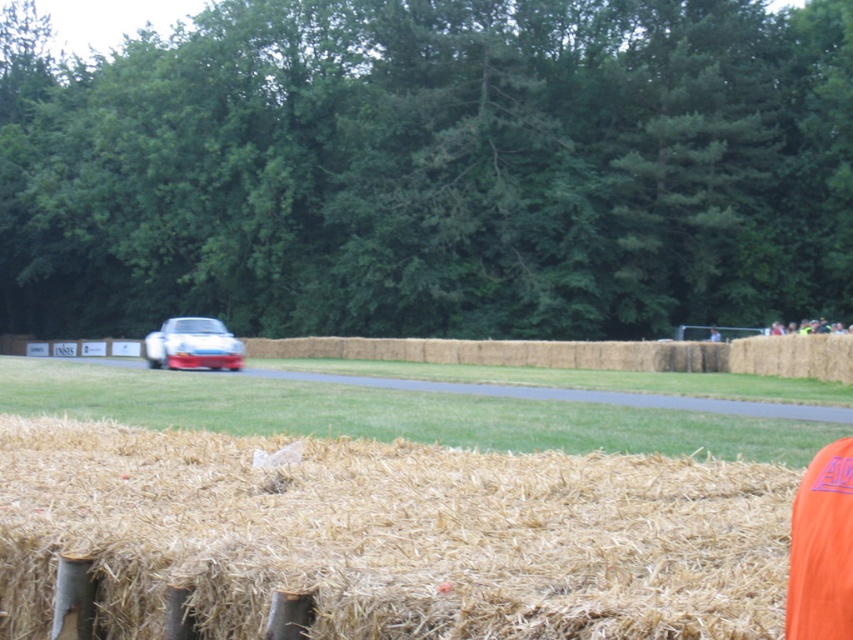
Looking at this image, you are a photographer trying to capture the white glossy car at center while ensuring the straw bales at lower center do not block the view. Based on their heights, will the car be visible over the straw bales?

The white glossy car at center is taller than the straw bales at lower center, so the car will be visible over the straw bales.

You are a delivery drone that needs to land on the smooth asphalt road at center. However, there are straw bales at lower center in the way. Can you safely descend vertically to the road without hitting the straw bales?

The straw bales at lower center has a lesser height compared to smooth asphalt road at center. Since the straw bales are shorter than the road, the drone can safely descend vertically to the road as the straw bales won not obstruct the path.

You are a driver who wants to know if there is enough space to safely stop your car on the smooth asphalt road at center before reaching the white glossy car at center. Can you determine this based on the information provided?

The smooth asphalt road at center is larger in size than the white glossy car at center, but without specific distance or speed information, it is impossible to determine if there is enough space to safely stop.